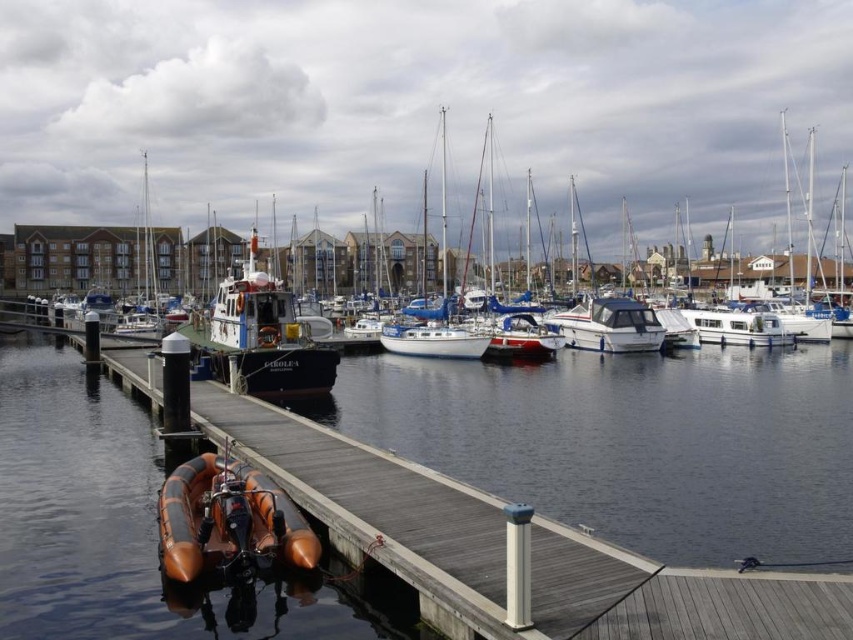
Question: Does wooden dock at center appear on the left side of wooden polished boat at left?

Choices:
 (A) yes
 (B) no

Answer: (B)

Question: Which point is farther from the camera taking this photo?

Choices:
 (A) (128, 465)
 (B) (354, 634)
 (C) (759, 314)
 (D) (225, 541)

Answer: (C)

Question: Based on their relative distances, which object is farther from the wooden dock at center?

Choices:
 (A) white glossy motorboat at center
 (B) white matte boat at center
 (C) rubber boat at dock
 (D) orange rubber dinghy at lower left

Answer: (B)

Question: Is rubber boat at dock positioned behind white matte boat at center?

Choices:
 (A) no
 (B) yes

Answer: (A)

Question: Can you confirm if wooden polished boat at left is positioned below white glossy motorboat at center?

Choices:
 (A) no
 (B) yes

Answer: (B)

Question: Which point is farther from the camera taking this photo?

Choices:
 (A) (242, 304)
 (B) (183, 312)
 (C) (595, 336)
 (D) (183, 497)

Answer: (B)